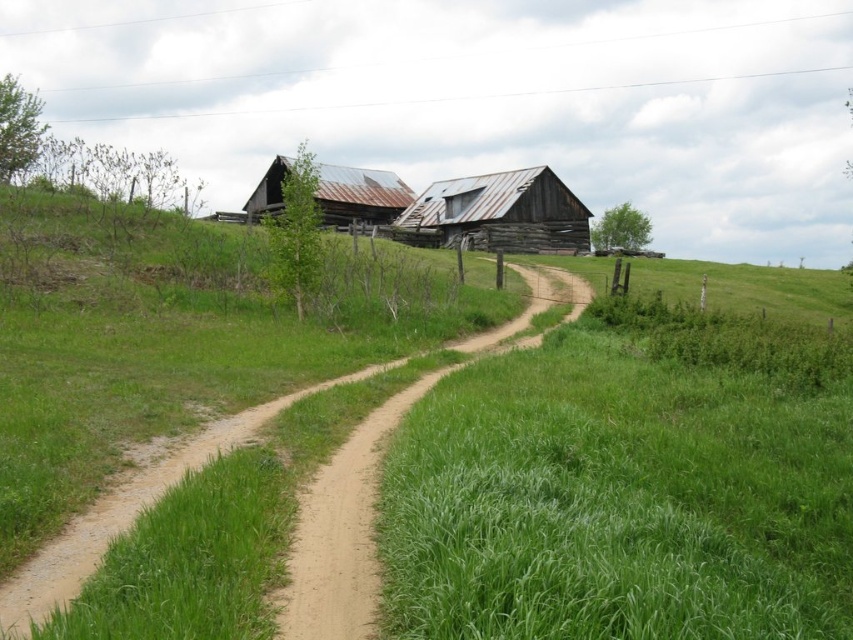
Is green grassy at center bigger than rusty metal barn at center?

No.

Who is positioned more to the right, green grassy at center or rusty metal barn at center?

green grassy at center

Does point (125, 545) come behind point (393, 195)?

No, it is in front of (393, 195).

Locate an element on the screen. green grassy at center is located at coordinates (619, 500).

Who is more forward, (569, 204) or (252, 202)?

Point (569, 204) is in front.

Who is shorter, weathered wood hut at center or rusty metal barn at center?

weathered wood hut at center is shorter.

Is point (573, 234) positioned behind point (351, 198)?

No, (573, 234) is in front of (351, 198).

Find the location of a particular element. The width and height of the screenshot is (853, 640). weathered wood hut at center is located at coordinates (502, 212).

Can you confirm if dirt path at center is positioned to the left of weathered wood hut at center?

Indeed, dirt path at center is positioned on the left side of weathered wood hut at center.

Does dirt path at center appear over weathered wood hut at center?

No, dirt path at center is not above weathered wood hut at center.

Does point (317, 547) come in front of point (448, 182)?

Yes, it is in front of point (448, 182).

I want to click on dirt path at center, so click(341, 532).